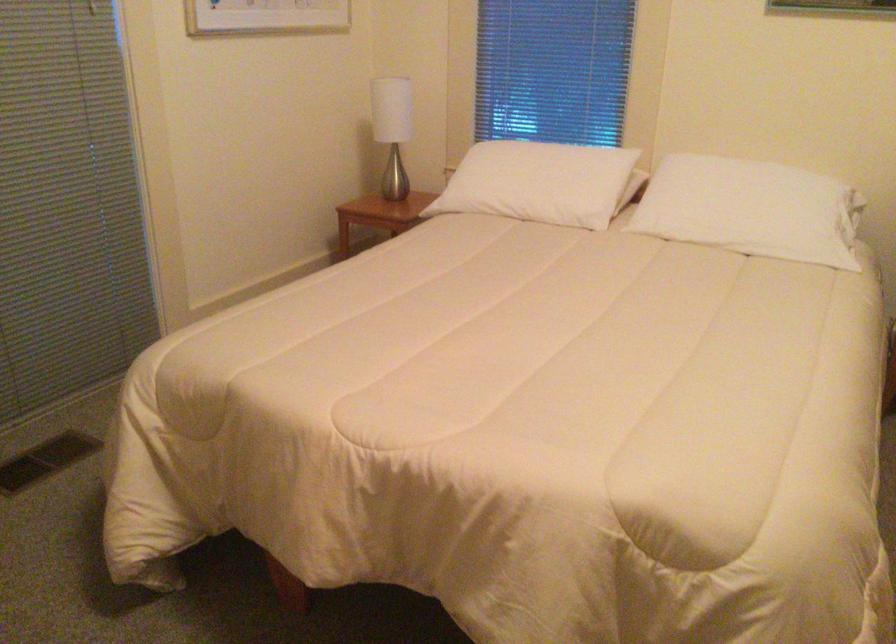
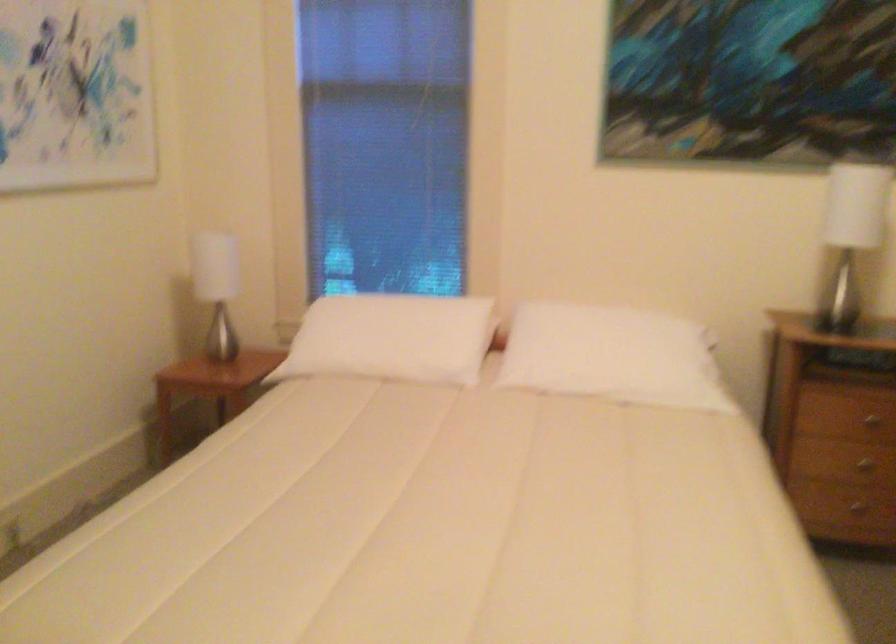
Question: Based on the continuous images, in which direction is the camera rotating? Reply with the corresponding letter.

Choices:
 (A) Left
 (B) Right
 (C) Up
 (D) Down

Answer: (B)